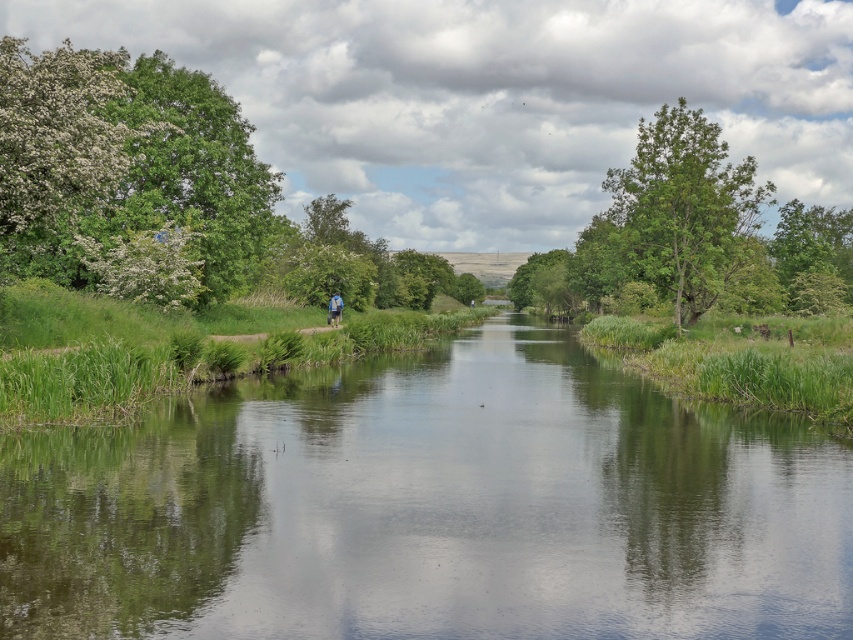
Which of these two, green leafy tree at right or blue fabric backpack at center, stands shorter?

With less height is blue fabric backpack at center.

Between green leafy tree at right and blue fabric backpack at center, which one has more height?

Standing taller between the two is green leafy tree at right.

Identify the location of green leafy tree at right. (682, 211).

This screenshot has width=853, height=640. I want to click on green leafy tree at right, so click(x=682, y=211).

Does point (846, 627) come closer to viewer compared to point (334, 321)?

Yes.

Can you confirm if green grassy stream at center is positioned below blue fabric backpack at center?

Yes, green grassy stream at center is below blue fabric backpack at center.

Find the location of a particular element. green grassy stream at center is located at coordinates (430, 508).

Find the location of a particular element. The width and height of the screenshot is (853, 640). green grassy stream at center is located at coordinates (430, 508).

Which of these two, green grassy stream at center or green leafy tree at right, stands shorter?

green grassy stream at center is shorter.

From the picture: Does green grassy stream at center lie in front of green leafy tree at right?

Yes, it is in front of green leafy tree at right.

Is point (791, 488) more distant than point (643, 161)?

That is False.

Identify the location of green grassy stream at center. The height and width of the screenshot is (640, 853). (430, 508).